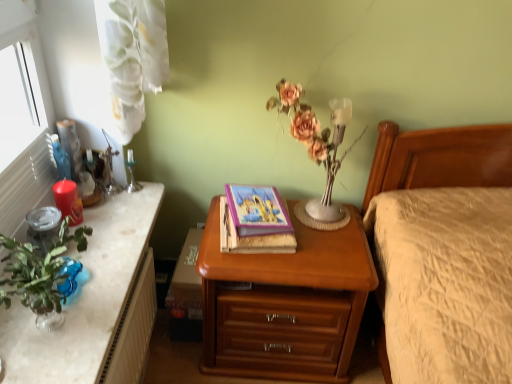
Locate an element on the screen. vacant area on top of green marble desk at left (from a real-world perspective) is located at coordinates (88, 261).